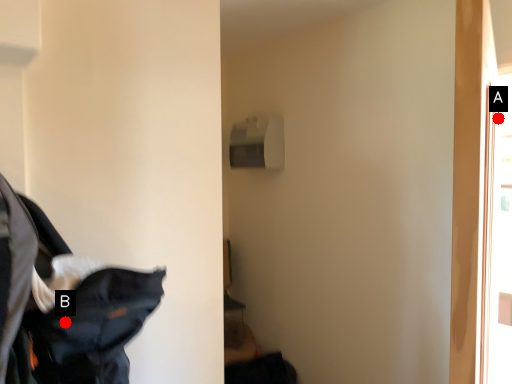
Question: Two points are circled on the image, labeled by A and B beside each circle. Which point appears farthest from the camera in this image?

Choices:
 (A) A is further
 (B) B is further

Answer: (A)